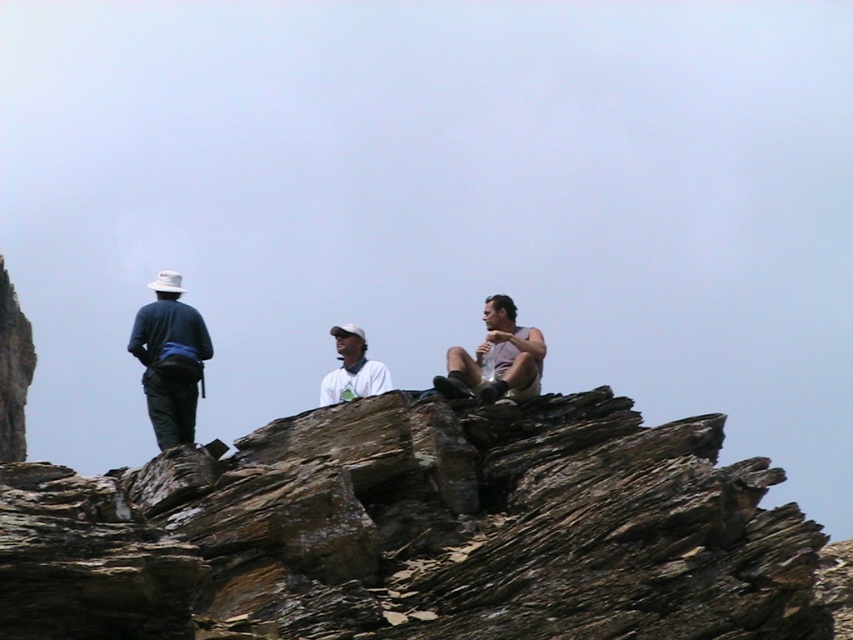
You are standing at the point labeled point (502,378) and want to walk to the point labeled point (355,394). According to the image, which direction should you move relative to your current position?

You should move backward because point (502,378) is in front of point (355,394), so to reach the latter, you need to go in the opposite direction.

You are a photographer planning to take a group photo of the matte blue shirt at left and the matte gray tank top at center. Considering their sizes, which one should you position closer to the camera to make them appear the same size in the photo?

The matte gray tank top at center is smaller in size, so positioning it closer to the camera will help balance their sizes in the photo.